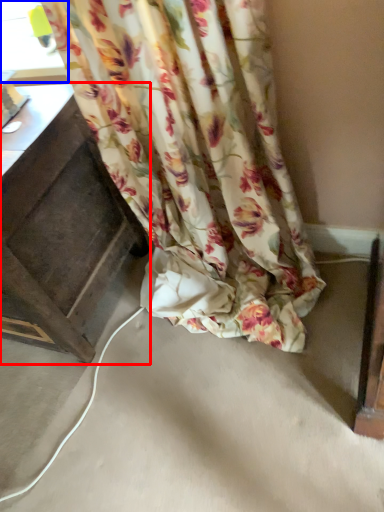
Question: Which object appears farthest to the camera in this image, furniture (highlighted by a red box) or window (highlighted by a blue box)?

Choices:
 (A) furniture
 (B) window

Answer: (B)